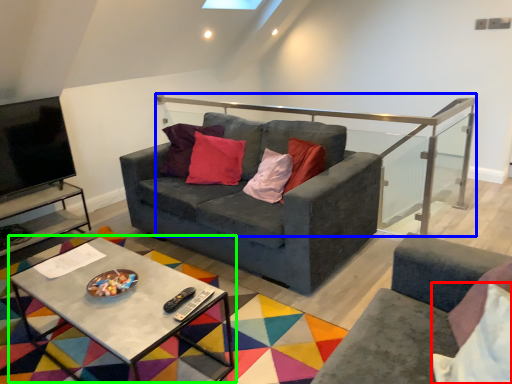
Question: Which is nearer to the pillow (highlighted by a red box)? balustrade (highlighted by a blue box) or coffee table (highlighted by a green box).

Choices:
 (A) balustrade
 (B) coffee table

Answer: (B)